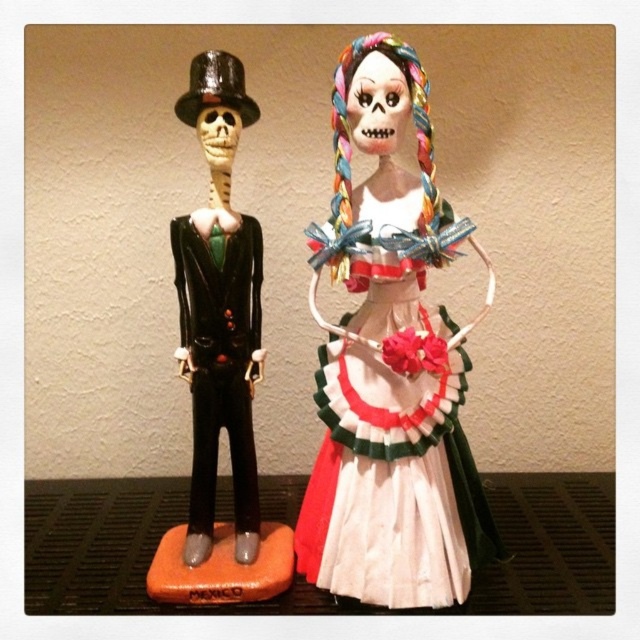
Based on the coordinates provided, which object is positioned at point (390,362)?

The matte black skeleton at left is positioned at point (390,362).

You are a collector of Mexican cultural artifacts and have limited shelf space. You need to place both the matte black skeleton at left and the white paper dress at center on a shelf. Given their sizes, which one should you place first to ensure both fit properly?

The matte black skeleton at left is larger than the white paper dress at center, so you should place the matte black skeleton at left first to accommodate its size before placing the smaller white paper dress at center.

You are standing in front of the two figurines. The matte black skeleton at left is positioned closer to you than the other figure. Which one should you approach first if you want to examine the closer one?

The matte black skeleton at left is closer to you, so you should approach the matte black skeleton at left first.